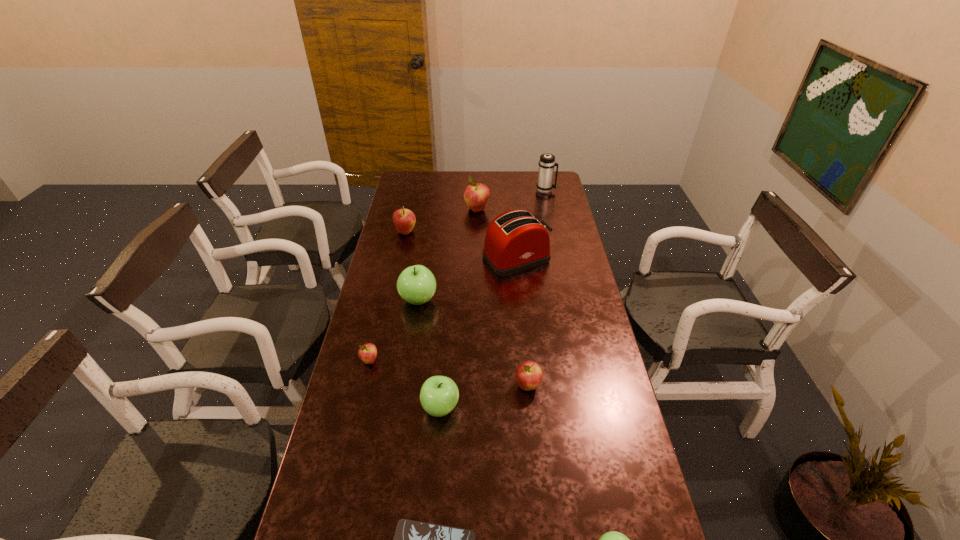
Locate an element on the screen. Image resolution: width=960 pixels, height=540 pixels. free space between the biggest green apple and the tallest apple is located at coordinates (447, 255).

Locate an element on the screen. This screenshot has height=540, width=960. vacant space in between the biggest green apple and the second farthest object is located at coordinates (447, 255).

Find the location of a particular element. The image size is (960, 540). the eighth closest object to the nearest apple is located at coordinates (476, 195).

The height and width of the screenshot is (540, 960). Find the location of `object that is the third nearest to the third nearest red apple`. object that is the third nearest to the third nearest red apple is located at coordinates (416, 284).

Find the location of a particular element. This screenshot has height=540, width=960. apple object that ranks as the fifth closest to the second apple from right to left is located at coordinates (404, 220).

Identify which apple is the second nearest to the fifth nearest object. Please provide its 2D coordinates. Your answer should be formatted as a tuple, i.e. [(x, y)], where the tuple contains the x and y coordinates of a point satisfying the conditions above.

[(416, 284)]

Identify which red apple is located as the third nearest to the sixth nearest apple. Please provide its 2D coordinates. Your answer should be formatted as a tuple, i.e. [(x, y)], where the tuple contains the x and y coordinates of a point satisfying the conditions above.

[(529, 375)]

You are a GUI agent. You are given a task and a screenshot of the screen. Output one action in this format:
    pyautogui.click(x=<x>, y=<y>)
    Task: Click on the red apple that is the nearest to the smallest red apple
    
    Given the screenshot: What is the action you would take?
    pyautogui.click(x=529, y=375)

This screenshot has width=960, height=540. I want to click on green apple object that ranks as the closest to the fifth farthest object, so click(439, 395).

This screenshot has width=960, height=540. In order to click on the closest green apple to the nearest red apple in this screenshot , I will do `click(439, 395)`.